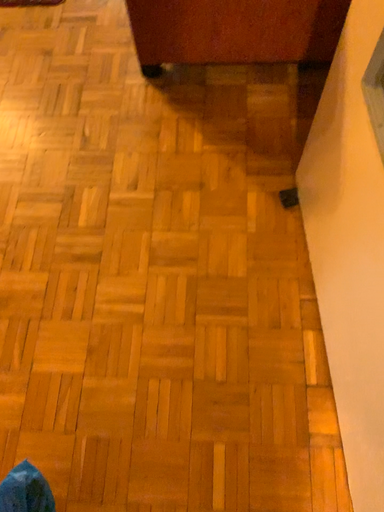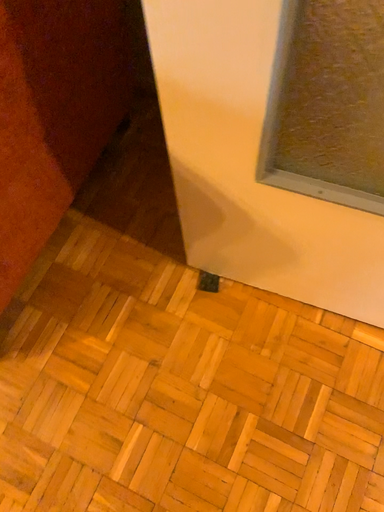
Question: Which way did the camera rotate in the video?

Choices:
 (A) rotated left
 (B) rotated right

Answer: (B)